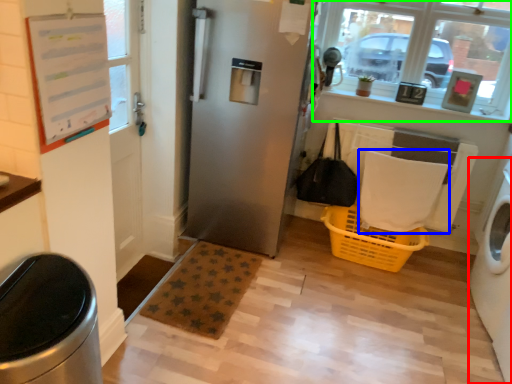
Question: Which object is positioned closest to washing machine (highlighted by a red box)? Select from blanket (highlighted by a blue box) and window (highlighted by a green box).

Choices:
 (A) blanket
 (B) window

Answer: (A)